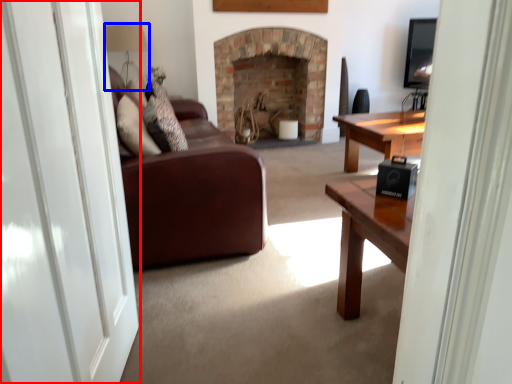
Question: Which object appears closest to the camera in this image, screen door (highlighted by a red box) or lamp (highlighted by a blue box)?

Choices:
 (A) screen door
 (B) lamp

Answer: (A)